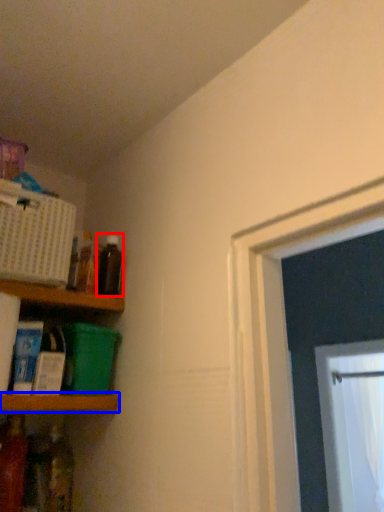
Question: Among these objects, which one is farthest to the camera, bottle (highlighted by a red box) or shelf (highlighted by a blue box)?

Choices:
 (A) bottle
 (B) shelf

Answer: (A)